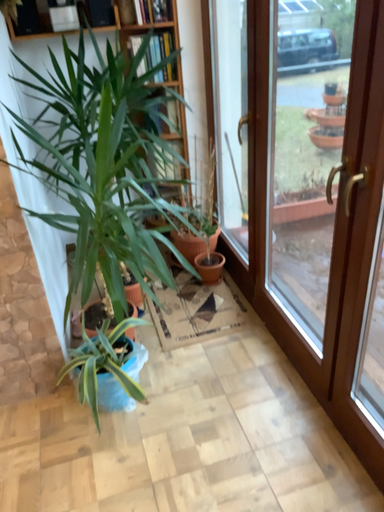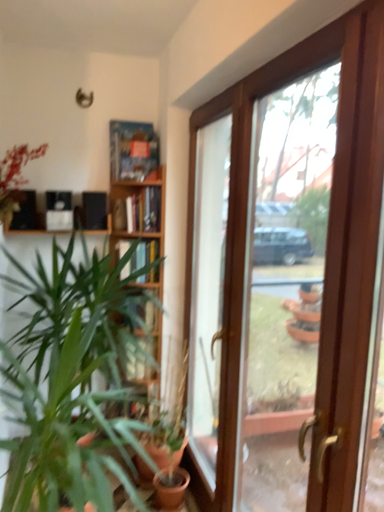
Question: How did the camera likely rotate when shooting the video?

Choices:
 (A) rotated upward
 (B) rotated downward

Answer: (A)